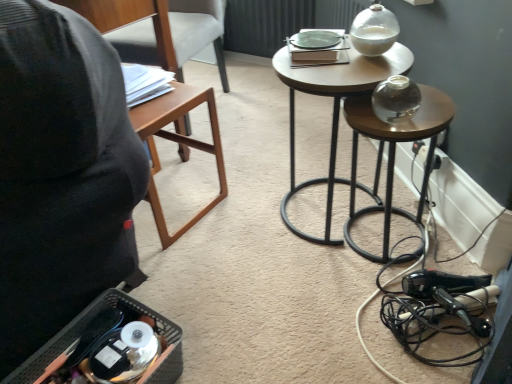
You are a GUI agent. You are given a task and a screenshot of the screen. Output one action in this format:
    pyautogui.click(x=<x>, y=<y>)
    Task: Click on the free space above brown wood table at left (from a real-world perspective)
    Image resolution: width=512 pixels, height=384 pixels.
    Given the screenshot: What is the action you would take?
    pyautogui.click(x=155, y=104)